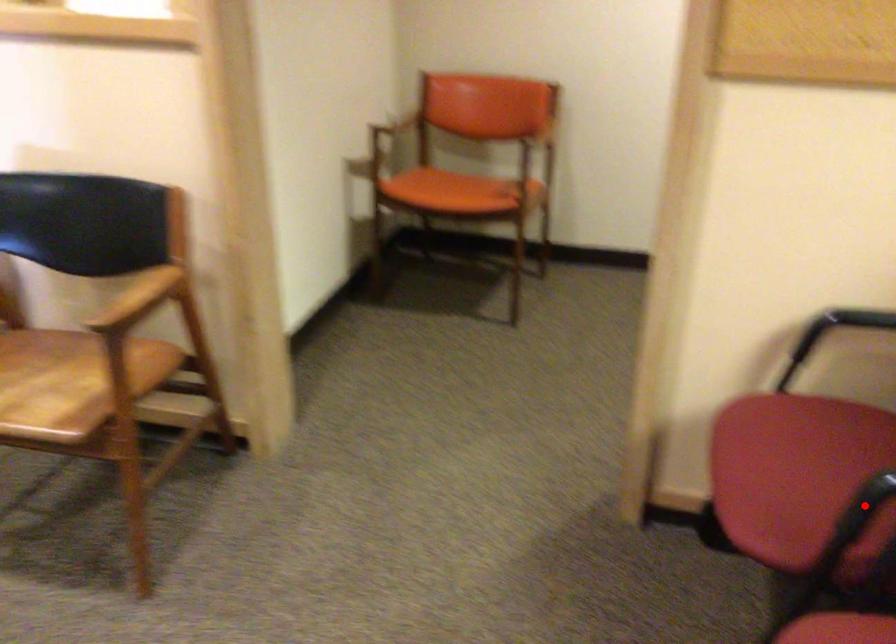
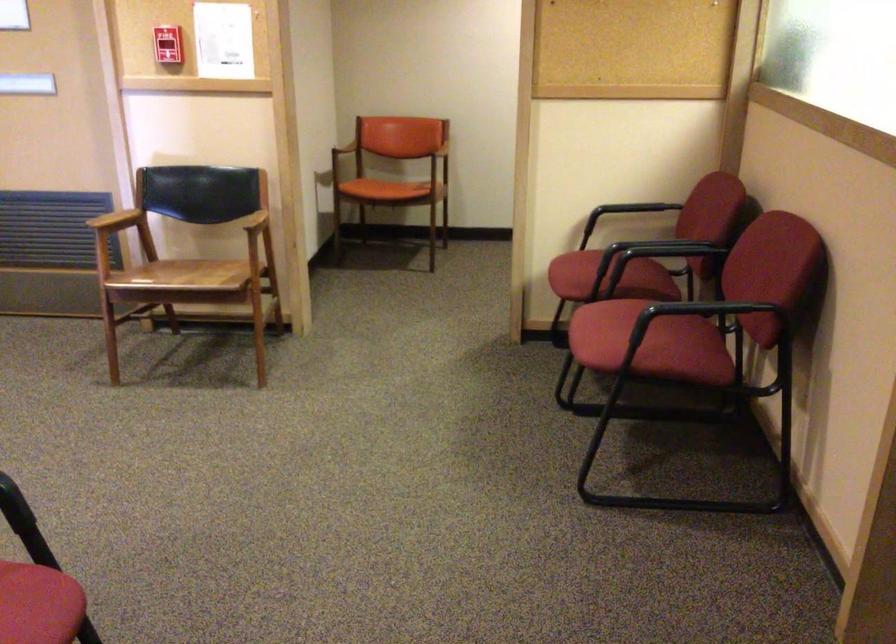
Question: I am providing you with two images of the same scene from different viewpoints. A red point is shown in image1. For the corresponding object point in image2, is it positioned nearer or farther from the camera?

Choices:
 (A) Nearer
 (B) Farther

Answer: (B)